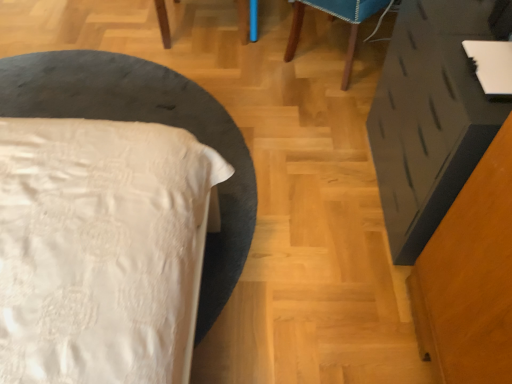
Question: Is wooden chair at upper center shorter than matte black vanity at right?

Choices:
 (A) no
 (B) yes

Answer: (B)

Question: From the image's perspective, would you say wooden chair at upper center is positioned over matte black vanity at right?

Choices:
 (A) no
 (B) yes

Answer: (B)

Question: Is wooden chair at upper center at the left side of matte black vanity at right?

Choices:
 (A) yes
 (B) no

Answer: (A)

Question: Is the depth of wooden chair at upper center less than that of matte black vanity at right?

Choices:
 (A) no
 (B) yes

Answer: (A)

Question: Is wooden chair at upper center facing towards matte black vanity at right?

Choices:
 (A) no
 (B) yes

Answer: (A)

Question: In the image, is white satin bed at left on the left side or the right side of matte black vanity at right?

Choices:
 (A) left
 (B) right

Answer: (A)

Question: Does point (59, 375) appear closer or farther from the camera than point (458, 72)?

Choices:
 (A) closer
 (B) farther

Answer: (A)

Question: From the image's perspective, is white satin bed at left above or below matte black vanity at right?

Choices:
 (A) below
 (B) above

Answer: (B)

Question: Is white satin bed at left wider or thinner than matte black vanity at right?

Choices:
 (A) wide
 (B) thin

Answer: (A)

Question: Is matte black vanity at right inside or outside of wooden chair at upper center?

Choices:
 (A) outside
 (B) inside

Answer: (A)

Question: Is point [x=437, y=137] closer or farther from the camera than point [x=347, y=64]?

Choices:
 (A) closer
 (B) farther

Answer: (A)

Question: Is matte black vanity at right bigger or smaller than wooden chair at upper center?

Choices:
 (A) small
 (B) big

Answer: (A)

Question: From the image's perspective, relative to wooden chair at upper center, is matte black vanity at right above or below?

Choices:
 (A) below
 (B) above

Answer: (A)

Question: Looking at their shapes, would you say white satin bed at left is wider or thinner than wooden chair at upper center?

Choices:
 (A) thin
 (B) wide

Answer: (B)

Question: Is point (95, 309) closer or farther from the camera than point (352, 16)?

Choices:
 (A) closer
 (B) farther

Answer: (A)